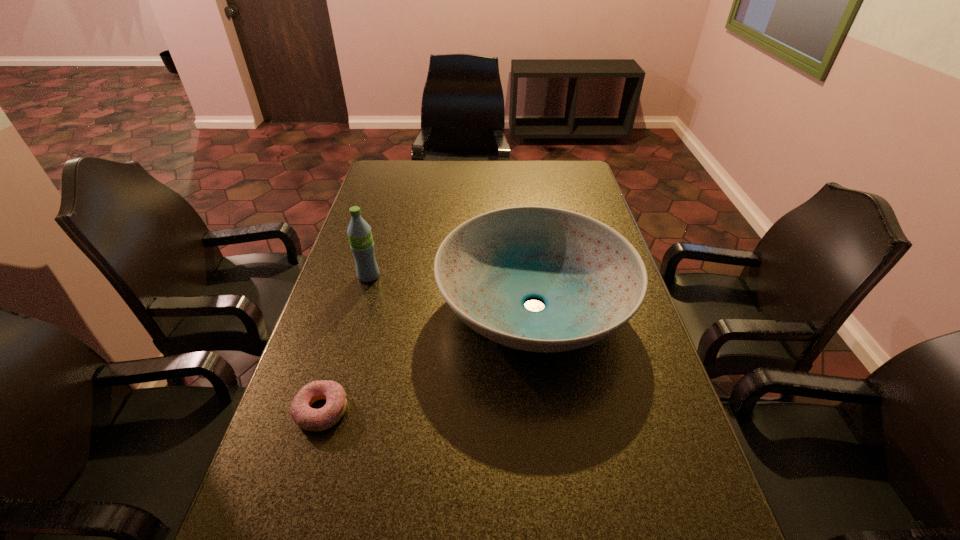
I want to click on the tallest object, so click(359, 232).

Locate an element on the screen. Image resolution: width=960 pixels, height=540 pixels. dish is located at coordinates (592, 280).

The width and height of the screenshot is (960, 540). Identify the location of the rightmost object. (592, 280).

Locate an element on the screen. the shortest object is located at coordinates (310, 419).

Where is `the nearest object`? The image size is (960, 540). the nearest object is located at coordinates (310, 419).

Where is `free space located on the front of the tallest object`? This screenshot has height=540, width=960. free space located on the front of the tallest object is located at coordinates (346, 356).

I want to click on vacant space located on the left of the second shortest object, so [x=370, y=306].

The height and width of the screenshot is (540, 960). What are the coordinates of `vacant space located on the front of the shortest object` in the screenshot? It's located at (289, 515).

This screenshot has width=960, height=540. I want to click on water bottle that is at the left edge, so click(x=359, y=232).

Where is `doughnut positioned at the left edge`? The height and width of the screenshot is (540, 960). doughnut positioned at the left edge is located at coordinates (310, 419).